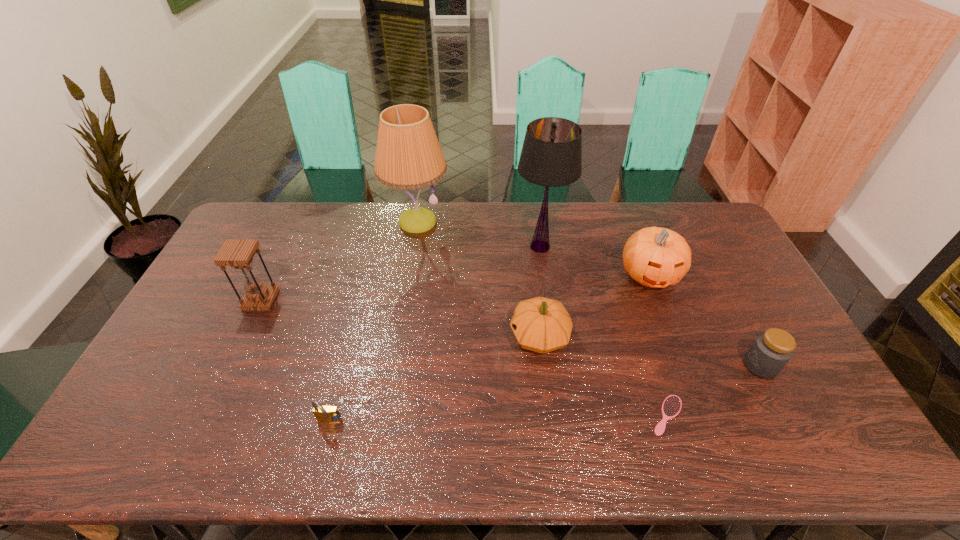
Where is `lampshade`? This screenshot has height=540, width=960. lampshade is located at coordinates (551, 156).

Locate an element on the screen. This screenshot has width=960, height=540. lamp is located at coordinates (408, 156).

In order to click on the leftmost object in this screenshot , I will do `click(238, 253)`.

Identify the location of pumpkin. This screenshot has width=960, height=540. (656, 257).

Find the location of `gourd`. gourd is located at coordinates (540, 324).

Locate an element on the screen. the sixth tallest object is located at coordinates (771, 351).

The width and height of the screenshot is (960, 540). What are the coordinates of `jar` in the screenshot? It's located at pyautogui.click(x=771, y=351).

At what (x,y) coordinates should I click in order to perform the action: click on padlock. Please return your answer as a coordinate pair (x, y). Image resolution: width=960 pixels, height=540 pixels. Looking at the image, I should click on (322, 413).

This screenshot has height=540, width=960. Find the location of `hairbrush`. hairbrush is located at coordinates (671, 406).

Identify the location of vacant space positioned 0.110m on the front-facing side of the lampshade. Image resolution: width=960 pixels, height=540 pixels. (482, 247).